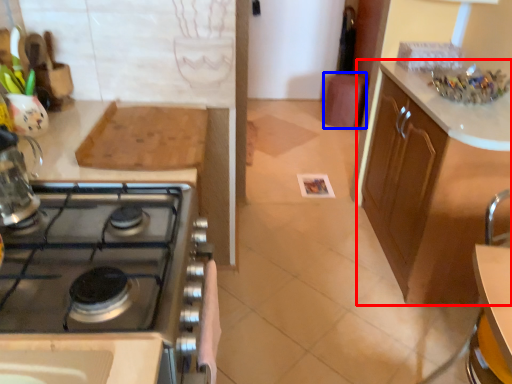
Question: Which of the following is the farthest to the observer, cabinetry (highlighted by a red box) or bar stool (highlighted by a blue box)?

Choices:
 (A) cabinetry
 (B) bar stool

Answer: (B)